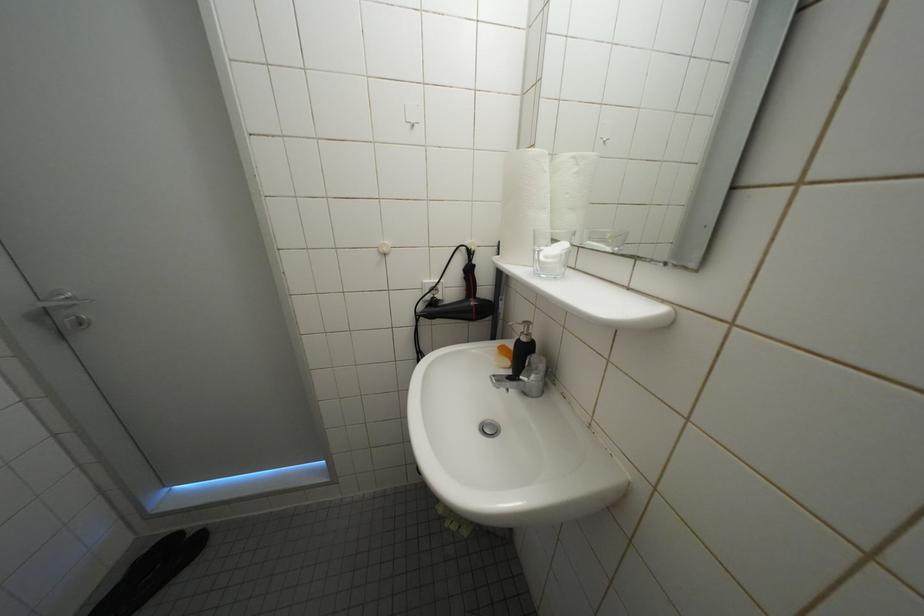
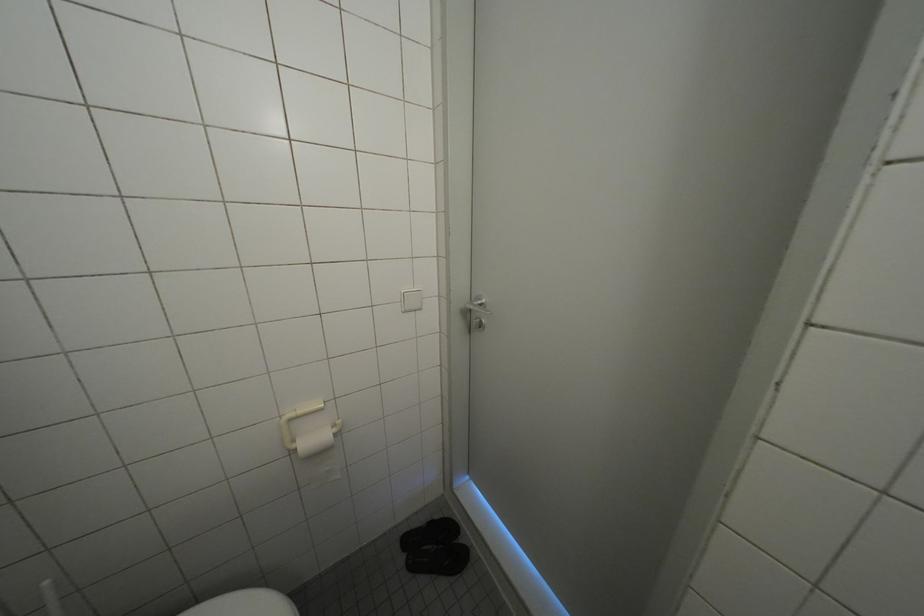
Question: The first image is from the beginning of the video and the second image is from the end. How did the camera likely rotate when shooting the video?

Choices:
 (A) Left
 (B) Right
 (C) Up
 (D) Down

Answer: (A)